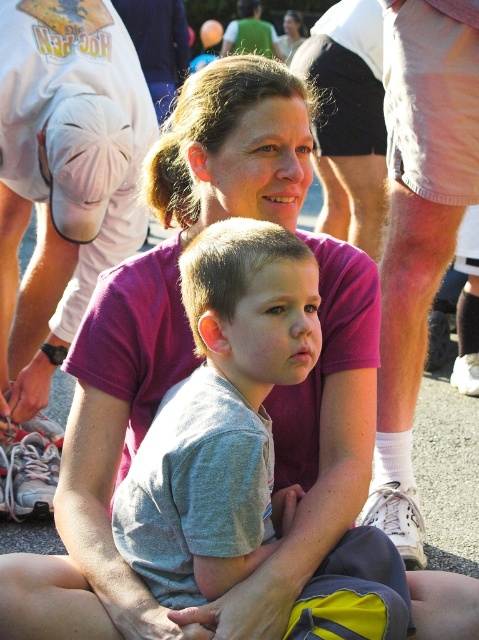
Who is more distant from viewer, (223, 225) or (405, 387)?

Positioned behind is point (405, 387).

Can you confirm if gray cotton shirt at center is bigger than white cotton shorts at right?

No.

Measure the distance between point (249, 312) and camera.

Point (249, 312) and camera are 2.10 meters apart from each other.

This screenshot has height=640, width=479. What are the coordinates of `gray cotton shirt at center` in the screenshot? It's located at pyautogui.click(x=220, y=416).

The width and height of the screenshot is (479, 640). What do you see at coordinates (70, 172) in the screenshot?
I see `white cotton shirt at center` at bounding box center [70, 172].

Can you confirm if white cotton shirt at center is shorter than white cotton shorts at right?

Correct, white cotton shirt at center is not as tall as white cotton shorts at right.

Measure the distance between white cotton shirt at center and camera.

A distance of 3.35 meters exists between white cotton shirt at center and camera.

Identify the location of white cotton shirt at center. The image size is (479, 640). (70, 172).

Does point (19, 104) come closer to viewer compared to point (341, 99)?

Yes, point (19, 104) is in front of point (341, 99).

At what (x,y) coordinates should I click in order to perform the action: click on white cotton shirt at center. Please return your answer as a coordinate pair (x, y). Looking at the image, I should click on (70, 172).